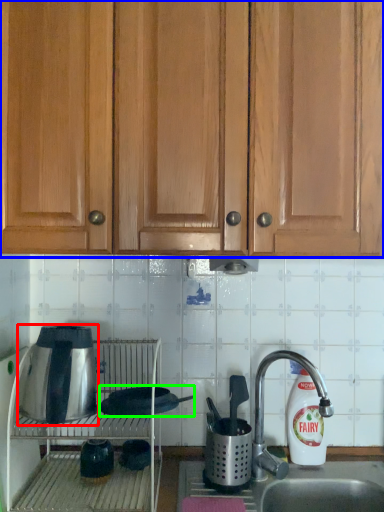
Question: Based on their relative distances, which object is farther from kitchen appliance (highlighted by a red box)? Choose from cabinetry (highlighted by a blue box) and appliance (highlighted by a green box).

Choices:
 (A) cabinetry
 (B) appliance

Answer: (A)